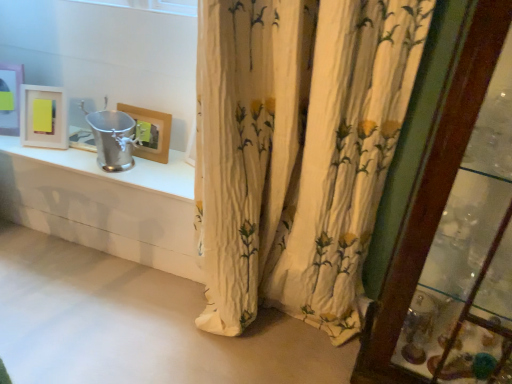
Question: Could you tell me if matte white picture frame at upper left, the second picture frame positioned from the left, is facing matte white picture frame at upper left, which ranks as the 1th picture frame in left-to-right order?

Choices:
 (A) no
 (B) yes

Answer: (A)

Question: Is matte white picture frame at upper left, which is counted as the third picture frame, starting from the right, inside matte white picture frame at upper left, the second picture frame positioned from the left?

Choices:
 (A) no
 (B) yes

Answer: (A)

Question: Considering the relative sizes of matte white picture frame at upper left, which is counted as the 2th picture frame, starting from the right, and matte white picture frame at upper left, which is counted as the third picture frame, starting from the right, in the image provided, is matte white picture frame at upper left, which is counted as the 2th picture frame, starting from the right, thinner than matte white picture frame at upper left, which is counted as the third picture frame, starting from the right,?

Choices:
 (A) yes
 (B) no

Answer: (B)

Question: Is matte white picture frame at upper left, the second picture frame positioned from the left, far away from matte white picture frame at upper left, which ranks as the 1th picture frame in left-to-right order?

Choices:
 (A) no
 (B) yes

Answer: (A)

Question: Does matte white picture frame at upper left, the second picture frame positioned from the left, have a smaller size compared to matte white picture frame at upper left, which ranks as the 1th picture frame in left-to-right order?

Choices:
 (A) yes
 (B) no

Answer: (B)

Question: From a real-world perspective, is white floral fabric curtain at center positioned above or below matte white picture frame at upper left, which ranks as the 1th picture frame in left-to-right order?

Choices:
 (A) above
 (B) below

Answer: (A)

Question: Based on their sizes in the image, would you say white floral fabric curtain at center is bigger or smaller than matte white picture frame at upper left, which ranks as the 1th picture frame in left-to-right order?

Choices:
 (A) big
 (B) small

Answer: (A)

Question: In terms of width, does white floral fabric curtain at center look wider or thinner when compared to matte white picture frame at upper left, which is counted as the third picture frame, starting from the right?

Choices:
 (A) thin
 (B) wide

Answer: (B)

Question: Relative to matte white picture frame at upper left, which ranks as the 1th picture frame in left-to-right order, is white floral fabric curtain at center in front or behind?

Choices:
 (A) behind
 (B) front

Answer: (B)

Question: Which is correct: wooden glass door at right is inside matte white picture frame at upper left, which is counted as the third picture frame, starting from the right, or outside of it?

Choices:
 (A) outside
 (B) inside

Answer: (A)

Question: Visually, is wooden glass door at right positioned to the left or to the right of matte white picture frame at upper left, which ranks as the 1th picture frame in left-to-right order?

Choices:
 (A) left
 (B) right

Answer: (B)

Question: From a real-world perspective, is wooden glass door at right above or below matte white picture frame at upper left, which is counted as the third picture frame, starting from the right?

Choices:
 (A) above
 (B) below

Answer: (A)

Question: From the image's perspective, is wooden glass door at right located above or below matte white picture frame at upper left, which is counted as the third picture frame, starting from the right?

Choices:
 (A) below
 (B) above

Answer: (A)

Question: Is matte white picture frame at upper left, the second picture frame positioned from the left, wider or thinner than white floral fabric curtain at center?

Choices:
 (A) thin
 (B) wide

Answer: (A)

Question: From a real-world perspective, relative to white floral fabric curtain at center, is matte white picture frame at upper left, the second picture frame positioned from the left, vertically above or below?

Choices:
 (A) above
 (B) below

Answer: (B)